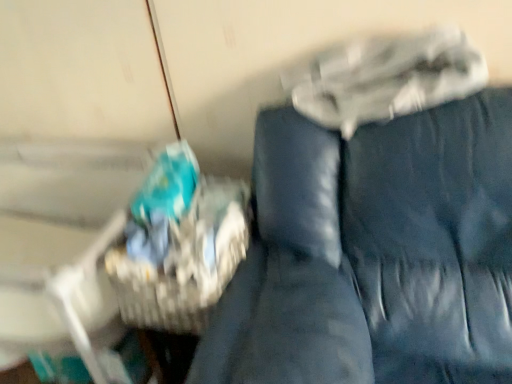
Question: Looking at their shapes, would you say woven brown basket at left is wider or thinner than blue fabric couch at center?

Choices:
 (A) thin
 (B) wide

Answer: (A)

Question: Is woven brown basket at left bigger or smaller than blue fabric couch at center?

Choices:
 (A) big
 (B) small

Answer: (B)

Question: Considering the positions of woven brown basket at left and blue fabric couch at center in the image, is woven brown basket at left taller or shorter than blue fabric couch at center?

Choices:
 (A) tall
 (B) short

Answer: (B)

Question: Is blue fabric couch at center in front of or behind woven brown basket at left in the image?

Choices:
 (A) behind
 (B) front

Answer: (B)

Question: In terms of size, does blue fabric couch at center appear bigger or smaller than woven brown basket at left?

Choices:
 (A) big
 (B) small

Answer: (A)

Question: From the image's perspective, is blue fabric couch at center positioned above or below woven brown basket at left?

Choices:
 (A) above
 (B) below

Answer: (B)

Question: Is blue fabric couch at center taller or shorter than woven brown basket at left?

Choices:
 (A) tall
 (B) short

Answer: (A)